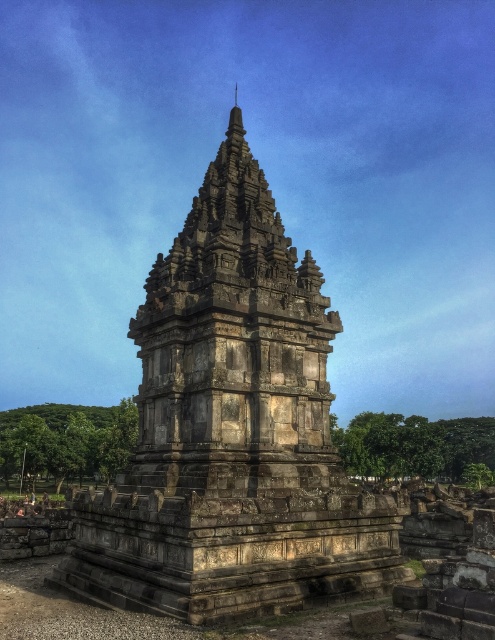
You are standing in front of the ancient stone structure. You notice two main parts of the structure labeled as the stone temple at center and the gray stone tower at center. Which one do you see closer to you?

The stone temple at center is in front of the gray stone tower at center, so you see the stone temple at center closer to you.